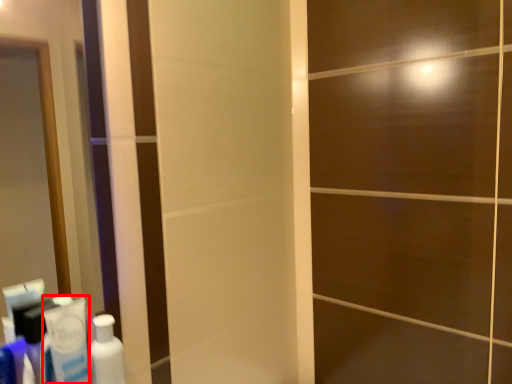
Question: In this image, where is toothpaste (annotated by the red box) located relative to bottle?

Choices:
 (A) right
 (B) left

Answer: (B)